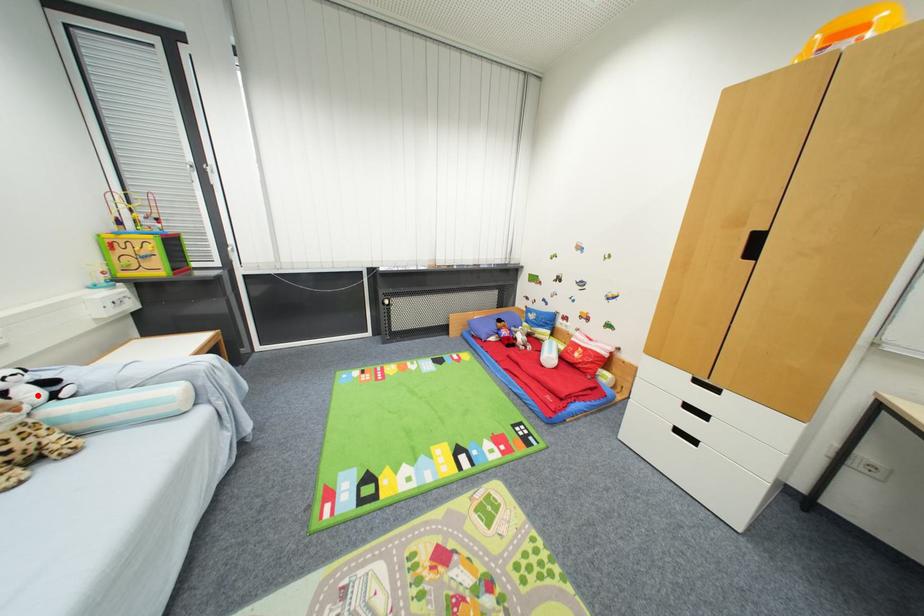
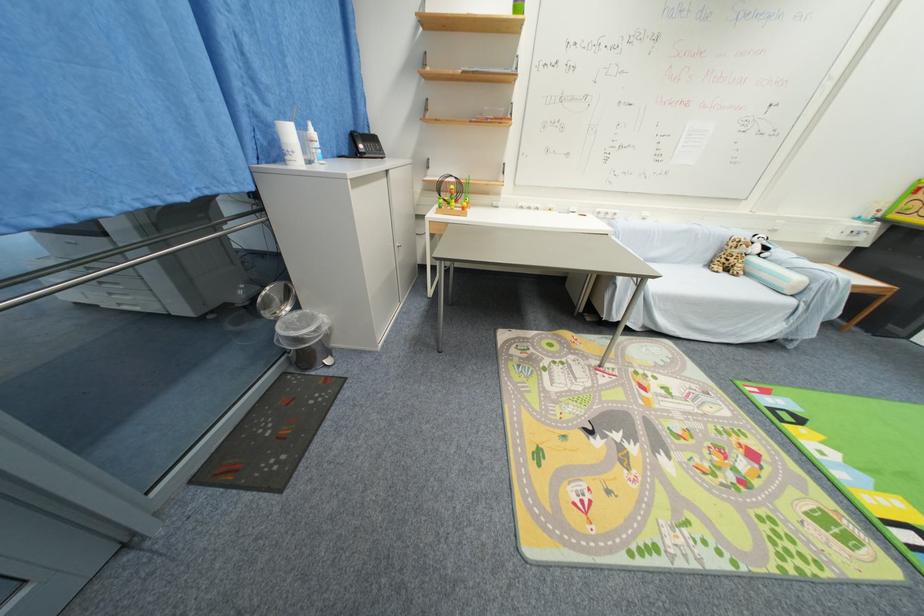
Question: A red point is marked in image1. In image2, is the corresponding 3D point closer to the camera or farther? Reply with the corresponding letter.

Choices:
 (A) The corresponding 3D point is closer.
 (B) The corresponding 3D point is farther.

Answer: (A)